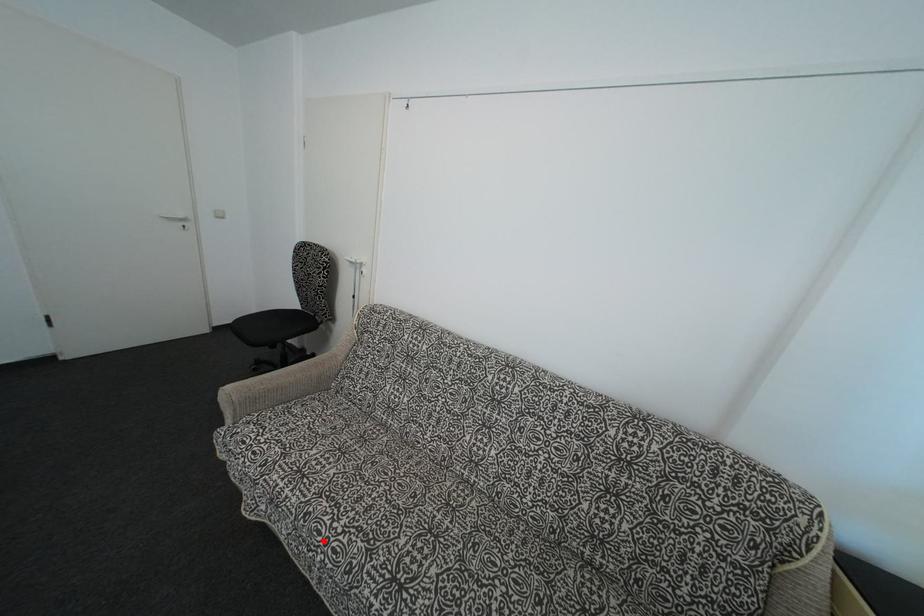
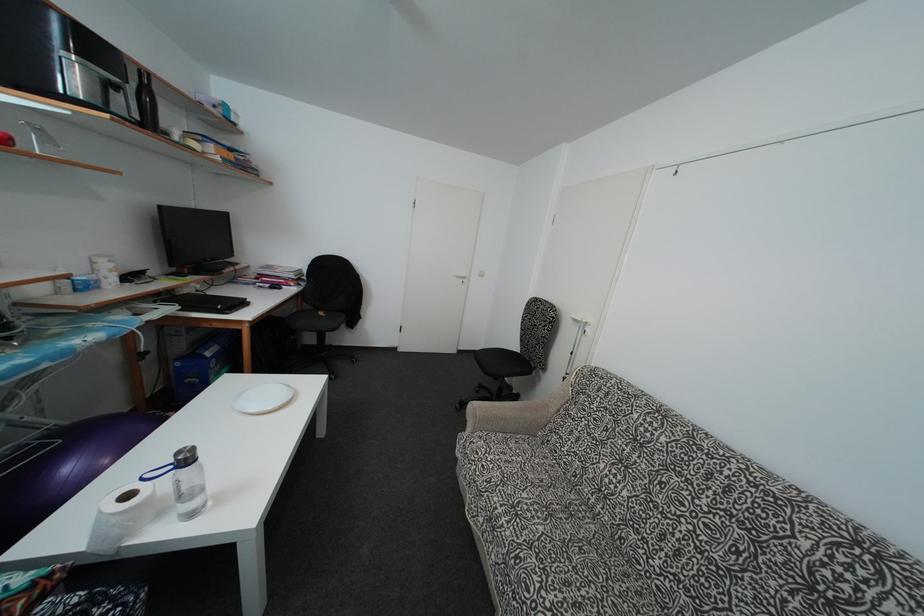
Locate, in the second image, the point that corresponds to the highlighted location in the first image.

(532, 598)